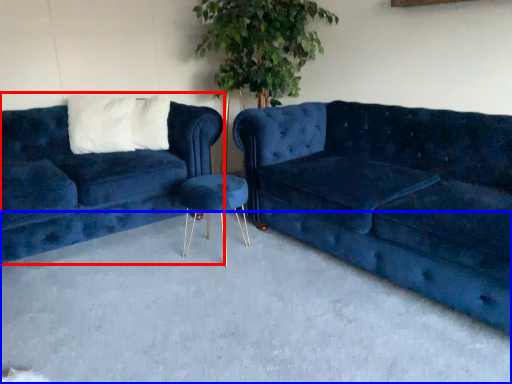
Question: Which object appears closest to the camera in this image, studio couch (highlighted by a red box) or concrete (highlighted by a blue box)?

Choices:
 (A) studio couch
 (B) concrete

Answer: (B)